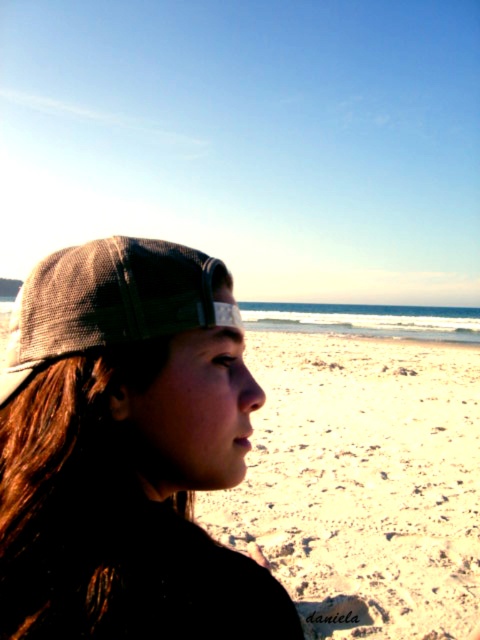
Is point (113, 586) in front of point (57, 344)?

Yes, it is.

Which is more to the right, brown mesh cap at left or gray mesh baseball cap at left?

Positioned to the right is brown mesh cap at left.

Between point (154, 504) and point (182, 294), which one is positioned behind?

The point (182, 294) is more distant.

In order to click on brown mesh cap at left in this screenshot , I will do `click(127, 451)`.